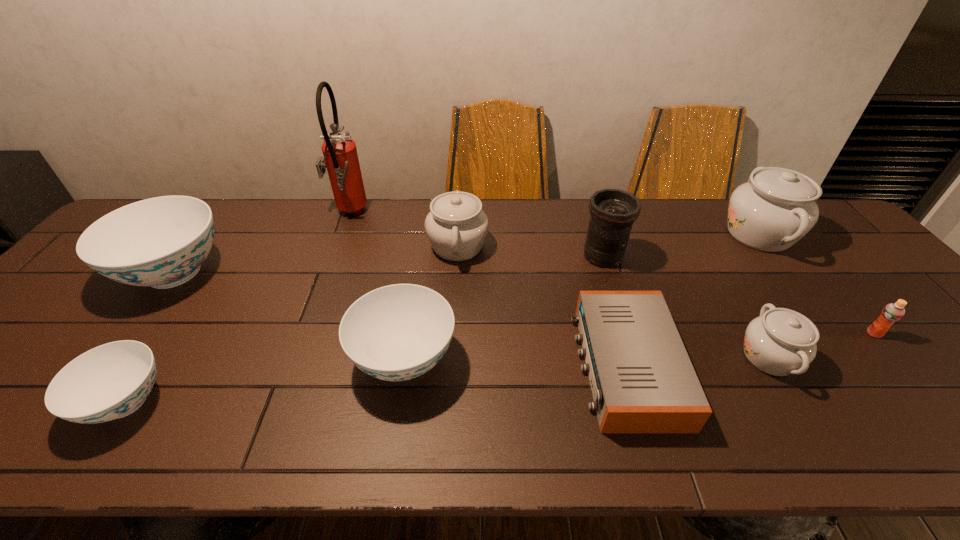
Identify which chinaware is the fifth closest to the tallest chinaware. Please provide its 2D coordinates. Your answer should be formatted as a tuple, i.e. [(x, y)], where the tuple contains the x and y coordinates of a point satisfying the conditions above.

[(161, 242)]

Identify which white chinaware is the third closest to the eighth object from right to left. Please provide its 2D coordinates. Your answer should be formatted as a tuple, i.e. [(x, y)], where the tuple contains the x and y coordinates of a point satisfying the conditions above.

[(777, 207)]

Choose which white chinaware is the nearest neighbor to the third object from left to right. Please provide its 2D coordinates. Your answer should be formatted as a tuple, i.e. [(x, y)], where the tuple contains the x and y coordinates of a point satisfying the conditions above.

[(456, 226)]

The height and width of the screenshot is (540, 960). Find the location of `blue chinaware that is the second closest to the rightmost blue chinaware`. blue chinaware that is the second closest to the rightmost blue chinaware is located at coordinates (161, 242).

Identify which blue chinaware is located as the nearest to the smallest blue chinaware. Please provide its 2D coordinates. Your answer should be formatted as a tuple, i.e. [(x, y)], where the tuple contains the x and y coordinates of a point satisfying the conditions above.

[(161, 242)]

Identify the location of free point that satisfies the following two spatial constraints: 1. at the nozzle of the tallest object; 2. on the back side of the rightmost blue chinaware. (294, 359).

The image size is (960, 540). What are the coordinates of `vacant region that satisfies the following two spatial constraints: 1. at the nozzle of the tallest object; 2. on the left side of the rightmost white chinaware` in the screenshot? It's located at (341, 234).